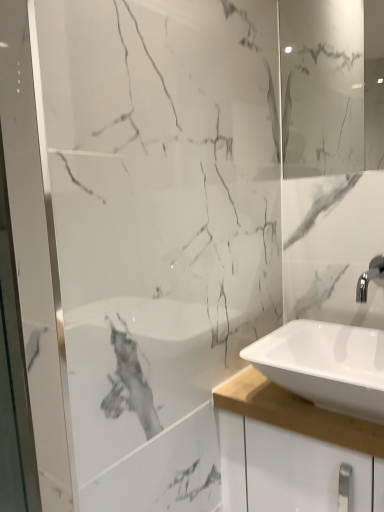
Find the location of `white glossy mirror at upper right`. white glossy mirror at upper right is located at coordinates (331, 86).

Image resolution: width=384 pixels, height=512 pixels. Describe the element at coordinates (331, 86) in the screenshot. I see `white glossy mirror at upper right` at that location.

At what (x,y) coordinates should I click in order to perform the action: click on white glossy sink at lower right. Please return your answer as a coordinate pair (x, y). The image size is (384, 512). Looking at the image, I should click on (326, 365).

What do you see at coordinates (326, 365) in the screenshot? The height and width of the screenshot is (512, 384). I see `white glossy sink at lower right` at bounding box center [326, 365].

The height and width of the screenshot is (512, 384). Identify the location of white glossy mirror at upper right. (331, 86).

Considering the relative positions of white glossy sink at lower right and white glossy mirror at upper right in the image provided, is white glossy sink at lower right to the left or to the right of white glossy mirror at upper right?

Based on their positions, white glossy sink at lower right is located to the left of white glossy mirror at upper right.

Considering the relative positions of white glossy sink at lower right and white glossy mirror at upper right in the image provided, is white glossy sink at lower right in front of white glossy mirror at upper right?

Yes.

Does point (282, 344) come closer to viewer compared to point (286, 163)?

Yes, point (282, 344) is in front of point (286, 163).

From the image's perspective, is white glossy sink at lower right located above or below white glossy mirror at upper right?

Clearly, from the image's perspective, white glossy sink at lower right is below white glossy mirror at upper right.

From a real-world perspective, who is located lower, white glossy sink at lower right or white glossy mirror at upper right?

white glossy sink at lower right is physically lower.

Which of these two, white glossy sink at lower right or white glossy mirror at upper right, is wider?

With larger width is white glossy sink at lower right.

Who is shorter, white glossy sink at lower right or white glossy mirror at upper right?

Standing shorter between the two is white glossy sink at lower right.

Considering the sizes of white glossy sink at lower right and white glossy mirror at upper right in the image, is white glossy sink at lower right bigger or smaller than white glossy mirror at upper right?

Clearly, white glossy sink at lower right is larger in size than white glossy mirror at upper right.

Would you say white glossy sink at lower right contains white glossy mirror at upper right?

No, white glossy sink at lower right does not contain white glossy mirror at upper right.

Are white glossy sink at lower right and white glossy mirror at upper right beside each other?

white glossy sink at lower right and white glossy mirror at upper right are clearly separated.

Is white glossy sink at lower right oriented away from white glossy mirror at upper right?

No, white glossy sink at lower right's orientation is not away from white glossy mirror at upper right.

How many degrees apart are the facing directions of white glossy sink at lower right and white glossy mirror at upper right?

The angular difference between white glossy sink at lower right and white glossy mirror at upper right is 0.605 degrees.

How distant is white glossy sink at lower right from white glossy mirror at upper right?

white glossy sink at lower right is 29.12 inches away from white glossy mirror at upper right.

At what (x,y) coordinates should I click in order to perform the action: click on sink that appears in front of the white glossy mirror at upper right. Please return your answer as a coordinate pair (x, y). This screenshot has height=512, width=384. Looking at the image, I should click on (326, 365).

Is white glossy mirror at upper right at the left side of white glossy sink at lower right?

In fact, white glossy mirror at upper right is to the right of white glossy sink at lower right.

Looking at this image, between white glossy mirror at upper right and white glossy sink at lower right, which one is positioned behind?

white glossy mirror at upper right is further away from the camera.

Does point (382, 95) appear closer or farther from the camera than point (286, 339)?

Point (382, 95).

From the image's perspective, is white glossy mirror at upper right above or below white glossy sink at lower right?

Clearly, from the image's perspective, white glossy mirror at upper right is above white glossy sink at lower right.

From a real-world perspective, which object stands above the other?

From a 3D spatial view, white glossy mirror at upper right is above.

Consider the image. Between white glossy mirror at upper right and white glossy sink at lower right, which one has larger width?

With larger width is white glossy sink at lower right.

Can you confirm if white glossy mirror at upper right is shorter than white glossy sink at lower right?

No, white glossy mirror at upper right is not shorter than white glossy sink at lower right.

Is white glossy mirror at upper right smaller than white glossy sink at lower right?

Indeed, white glossy mirror at upper right has a smaller size compared to white glossy sink at lower right.

Can white glossy sink at lower right be found inside white glossy mirror at upper right?

No.

Is white glossy mirror at upper right beside white glossy sink at lower right?

They are not placed beside each other.

Is white glossy mirror at upper right looking in the opposite direction of white glossy sink at lower right?

No, white glossy mirror at upper right's orientation is not away from white glossy sink at lower right.

I want to click on sink beneath the white glossy mirror at upper right (from a real-world perspective), so coord(326,365).

Identify the location of mirror behind the white glossy sink at lower right. (331, 86).

Identify the location of mirror above the white glossy sink at lower right (from a real-world perspective). (331, 86).